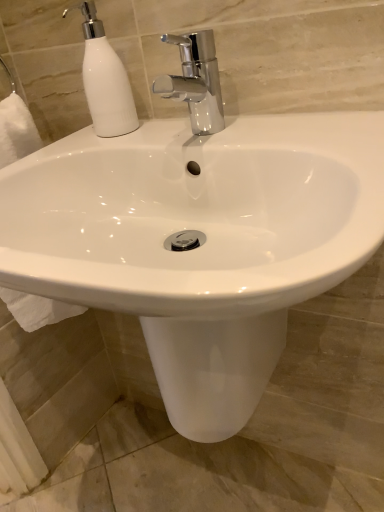
Locate an element on the screen. free location to the right of chrome metallic faucet at upper center is located at coordinates (286, 125).